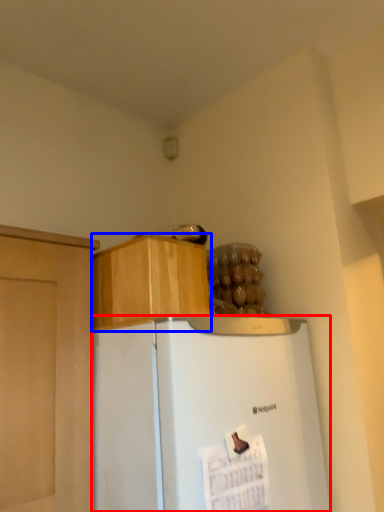
Question: Among these objects, which one is nearest to the camera, refrigerator (highlighted by a red box) or cabinetry (highlighted by a blue box)?

Choices:
 (A) refrigerator
 (B) cabinetry

Answer: (A)